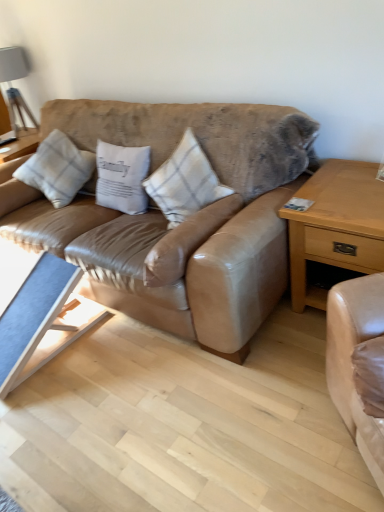
Question: From the image's perspective, would you say white cotton pillow at center, which is counted as the second pillow, starting from the right, is shown under leather couch at center?

Choices:
 (A) no
 (B) yes

Answer: (A)

Question: Is white cotton pillow at center, which is counted as the second pillow, starting from the right, far away from leather couch at center?

Choices:
 (A) no
 (B) yes

Answer: (A)

Question: Can you confirm if white cotton pillow at center, the 2th pillow from the left, is bigger than leather couch at center?

Choices:
 (A) no
 (B) yes

Answer: (A)

Question: From a real-world perspective, is white cotton pillow at center, the 2th pillow from the left, physically below leather couch at center?

Choices:
 (A) yes
 (B) no

Answer: (B)

Question: Is white cotton pillow at center, the 2th pillow from the left, at the left side of leather couch at center?

Choices:
 (A) no
 (B) yes

Answer: (B)

Question: From the image's perspective, is white cotton pillow at center, which is counted as the second pillow, starting from the right, over leather couch at center?

Choices:
 (A) no
 (B) yes

Answer: (B)

Question: Is white plaid pillow at center, the first pillow in the left-to-right sequence, positioned beyond the bounds of leather couch at center?

Choices:
 (A) yes
 (B) no

Answer: (B)

Question: Considering the relative sizes of white plaid pillow at center, the first pillow in the left-to-right sequence, and leather couch at center in the image provided, is white plaid pillow at center, the first pillow in the left-to-right sequence, taller than leather couch at center?

Choices:
 (A) no
 (B) yes

Answer: (A)

Question: Is white plaid pillow at center, the first pillow in the left-to-right sequence, closer to the viewer compared to leather couch at center?

Choices:
 (A) yes
 (B) no

Answer: (B)

Question: Does white plaid pillow at center, the first pillow in the left-to-right sequence, have a lesser height compared to leather couch at center?

Choices:
 (A) no
 (B) yes

Answer: (B)

Question: From the image's perspective, is white plaid pillow at center, which is counted as the 3th pillow, starting from the right, under leather couch at center?

Choices:
 (A) yes
 (B) no

Answer: (B)

Question: Does white plaid pillow at center, the first pillow in the left-to-right sequence, appear on the right side of leather couch at center?

Choices:
 (A) no
 (B) yes

Answer: (A)

Question: Can you confirm if matte gray lampshade at upper left is shorter than white cotton pillow at center, which is counted as the second pillow, starting from the right?

Choices:
 (A) yes
 (B) no

Answer: (B)